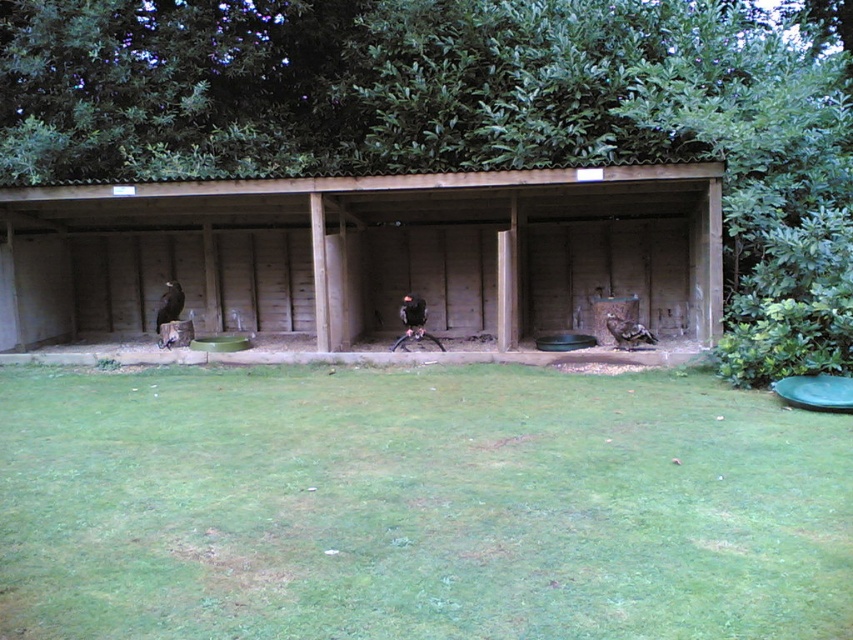
You are a zookeeper planning to place a new feeding station in the enclosure. The feeding station requires a space wider than the brown wooden hut at center. Can the green grass at center accommodate this requirement?

The green grass at center has a lesser width compared to the brown wooden hut at center, so it cannot accommodate the feeding station which needs a space wider than the brown wooden hut at center.

You are a bird of prey in the enclosure and want to land on the green grass at center. Based on the coordinates provided, can you estimate the exact location where you should aim to land?

The green grass at center is located at coordinates point (416, 506), so you should aim for that exact point to land on it.